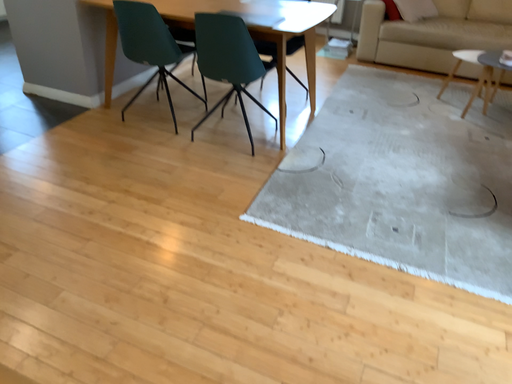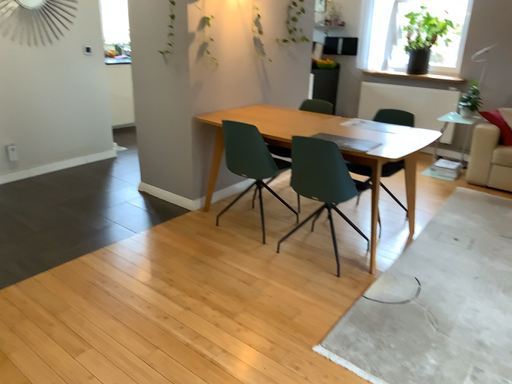
Question: Which way did the camera rotate in the video?

Choices:
 (A) rotated right
 (B) rotated left

Answer: (B)